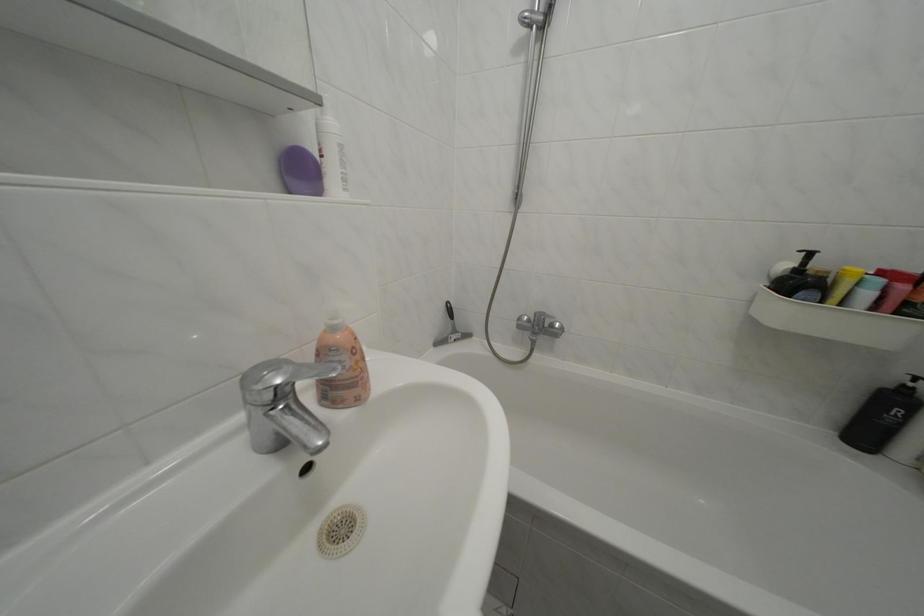
The width and height of the screenshot is (924, 616). What do you see at coordinates (341, 365) in the screenshot?
I see `the soap dispenser pump` at bounding box center [341, 365].